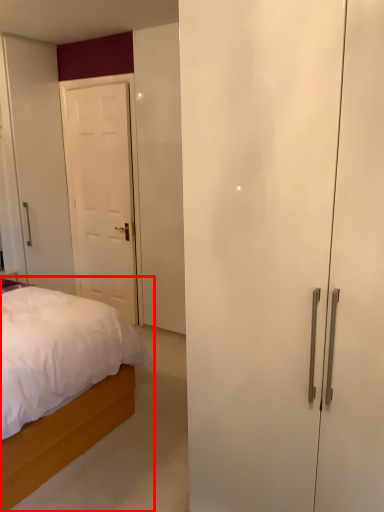
Question: From the image's perspective, considering the relative positions of bed (annotated by the red box) and door in the image provided, where is bed (annotated by the red box) located with respect to the staircase?

Choices:
 (A) above
 (B) below

Answer: (B)